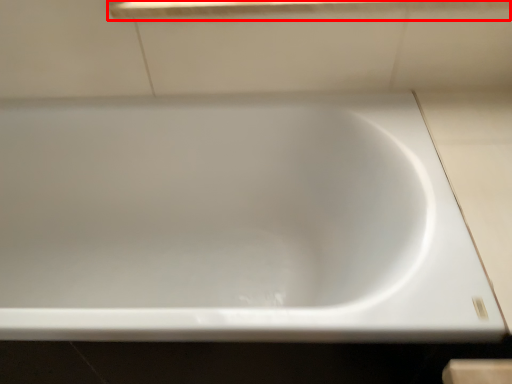
Question: From the image's perspective, considering the relative positions of window sill (annotated by the red box) and bathtub in the image provided, where is window sill (annotated by the red box) located with respect to the staircase?

Choices:
 (A) below
 (B) above

Answer: (B)